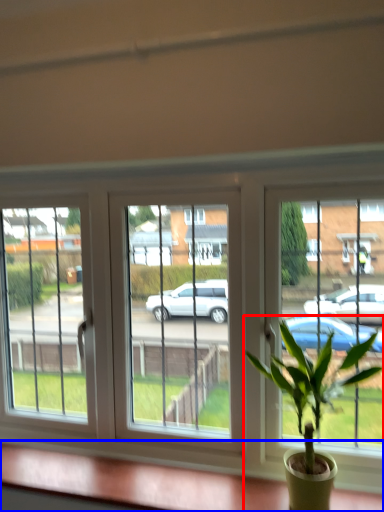
Question: Which object is further to the camera taking this photo, houseplant (highlighted by a red box) or window sill (highlighted by a blue box)?

Choices:
 (A) houseplant
 (B) window sill

Answer: (B)